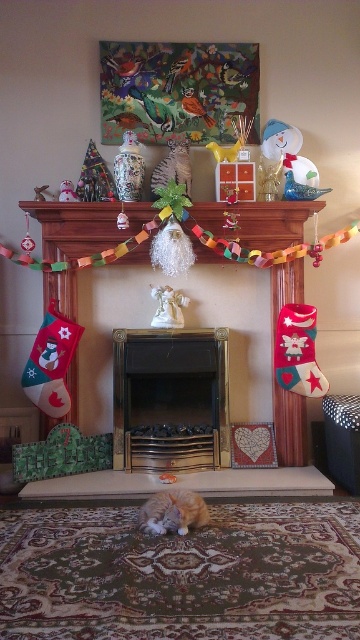
You are standing in the living room and see the point marked at coordinates (173, 513). Based on the scene description, can you identify what object this point is located on?

The point at coordinates (173, 513) is located on the fluffy orange cat at lower center.

You are a guest in the living room and want to pet the fluffy orange cat at lower center. However, there is a white porcelain angel at center in the way. Can you reach the cat without moving the angel?

The fluffy orange cat at lower center is below the white porcelain angel at center, so you can reach the cat by going around or under the angel since it is positioned higher up.

You are a delivery person who needs to place a small package on the mantelpiece. The mantelpiece has the fluffy orange cat at lower center and the porcelain vase at upper center. Which object should you move to make space for the package?

You should move the fluffy orange cat at lower center because it might be wider than the porcelain vase at upper center, so moving it would free up more space on the mantelpiece.